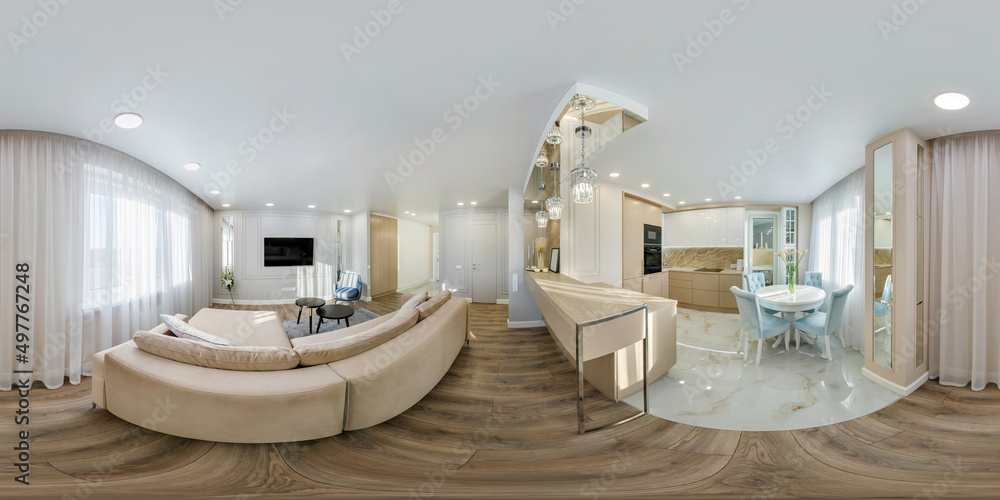
Where is `floor`? The image size is (1000, 500). floor is located at coordinates (423, 458), (690, 469), (690, 385).